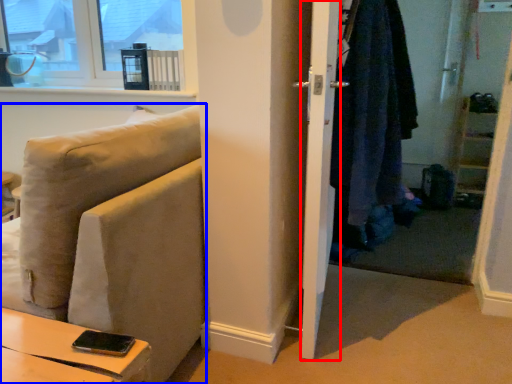
Question: Which object is further to the camera taking this photo, screen door (highlighted by a red box) or studio couch (highlighted by a blue box)?

Choices:
 (A) screen door
 (B) studio couch

Answer: (A)